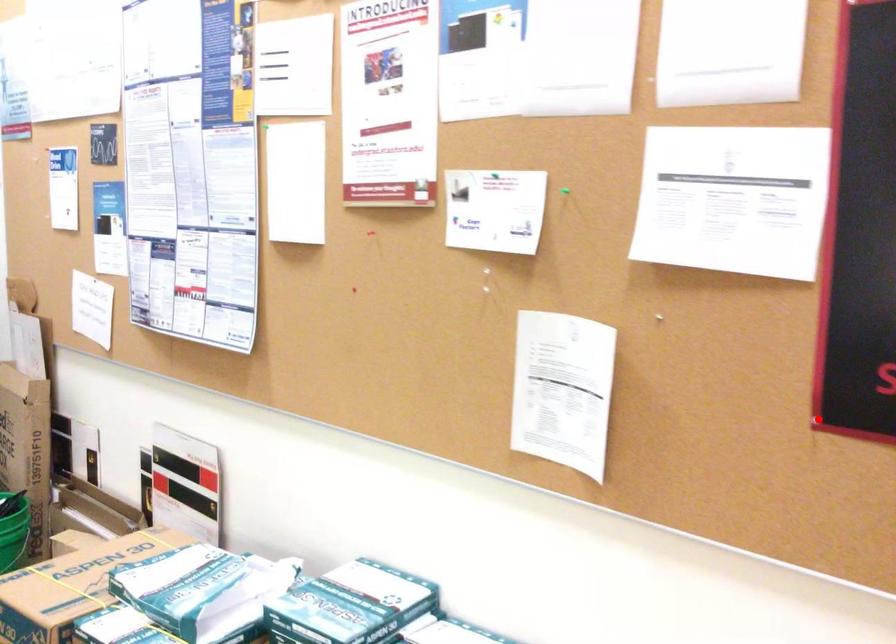
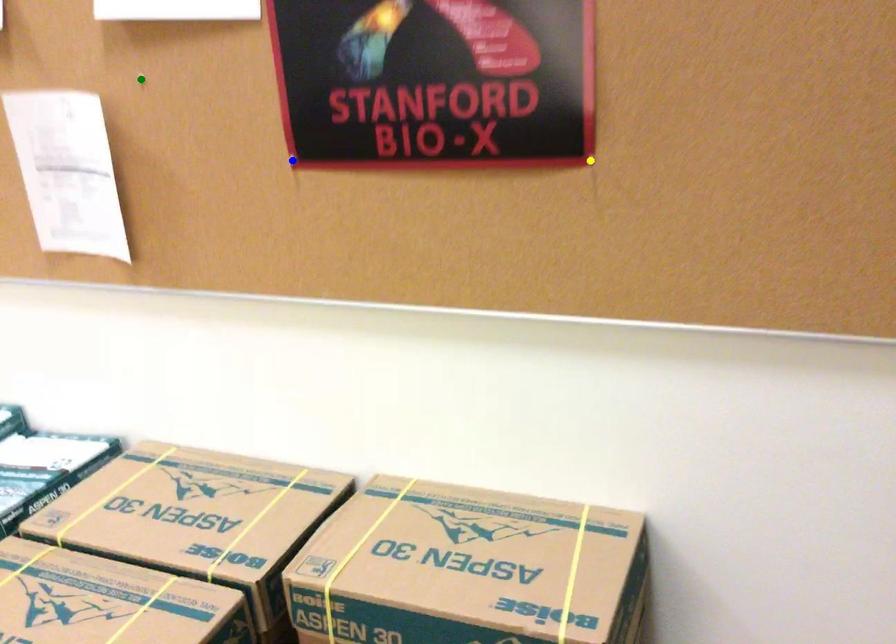
Question: I am providing you with two images of the same scene from different viewpoints. A red point is marked on the first image. You are given multiple points on the second image. Which point in image 2 is actually the same real-world point as the red point in image 1?

Choices:
 (A) blue point
 (B) yellow point
 (C) green point

Answer: (A)